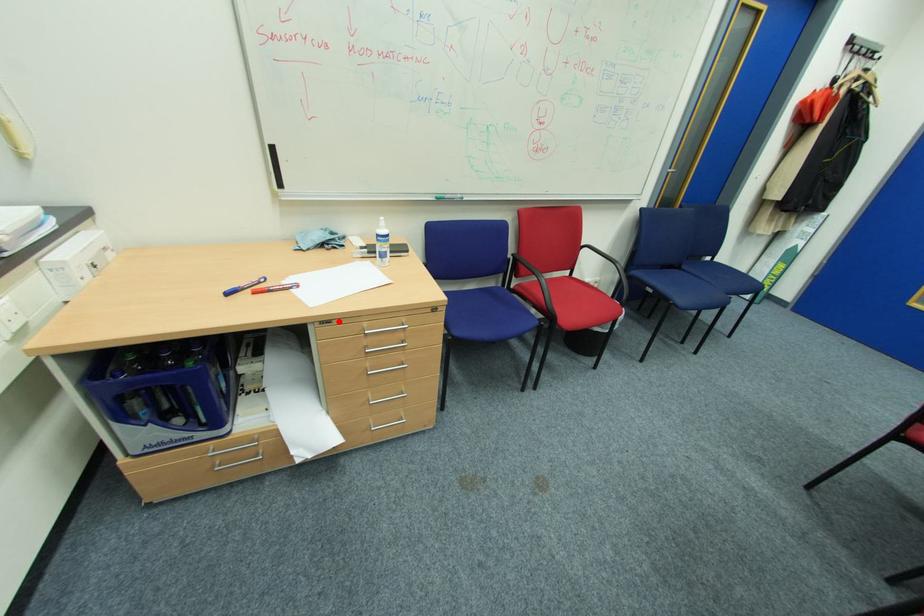
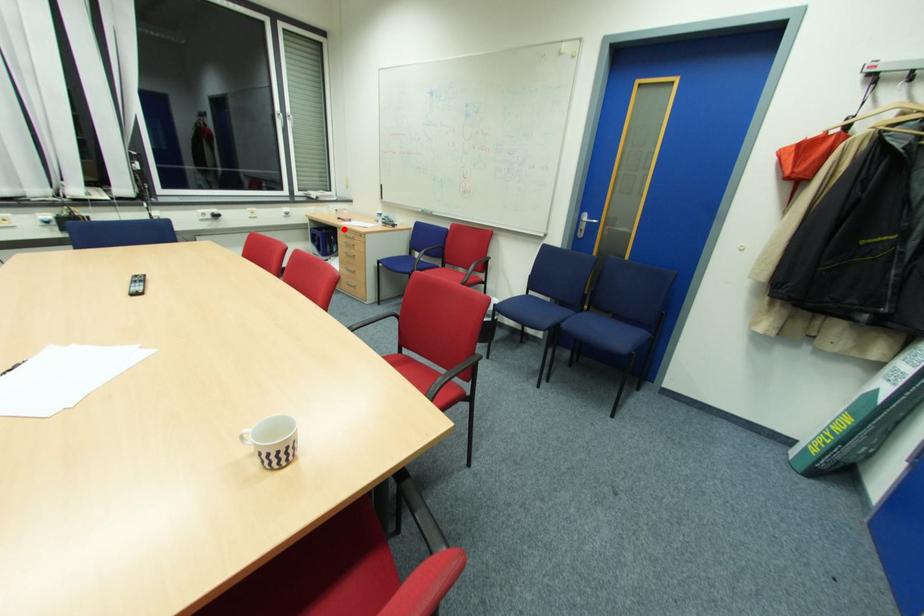
I am providing you with two images of the same scene from different viewpoints. A red point is marked on the first image and another point is marked on the second image. Are the points marked in image1 and image2 representing the same 3D position?

Yes